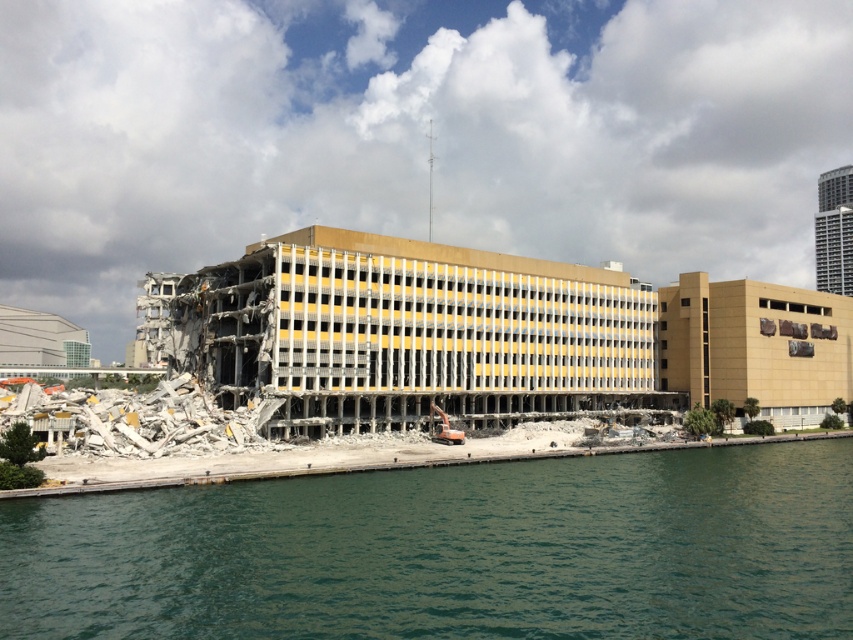
Between point (44, 513) and point (677, 392), which one is positioned in front?

Point (44, 513) is in front.

Is point (212, 580) closer to viewer compared to point (735, 296)?

Yes.

Where is `green water at lower left`? The image size is (853, 640). green water at lower left is located at coordinates (451, 552).